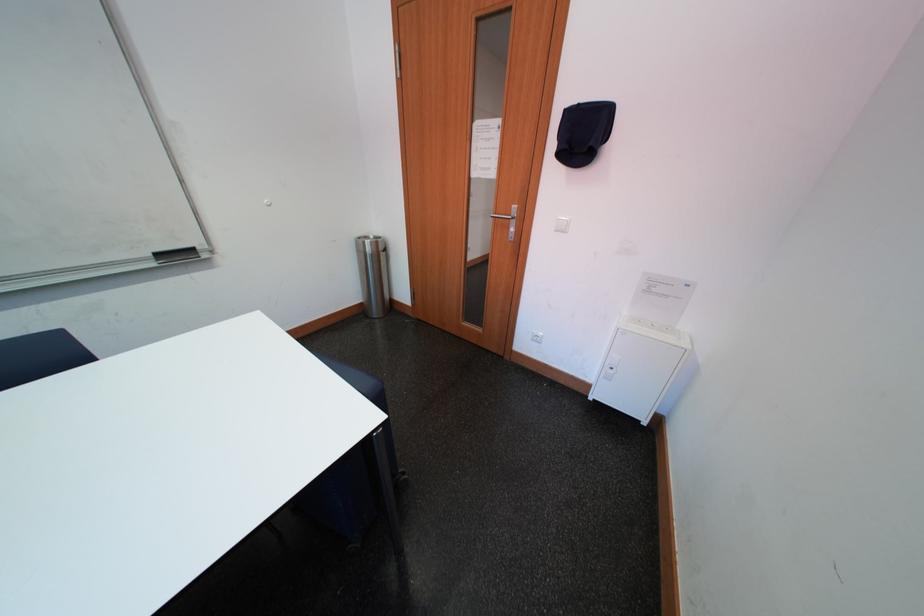
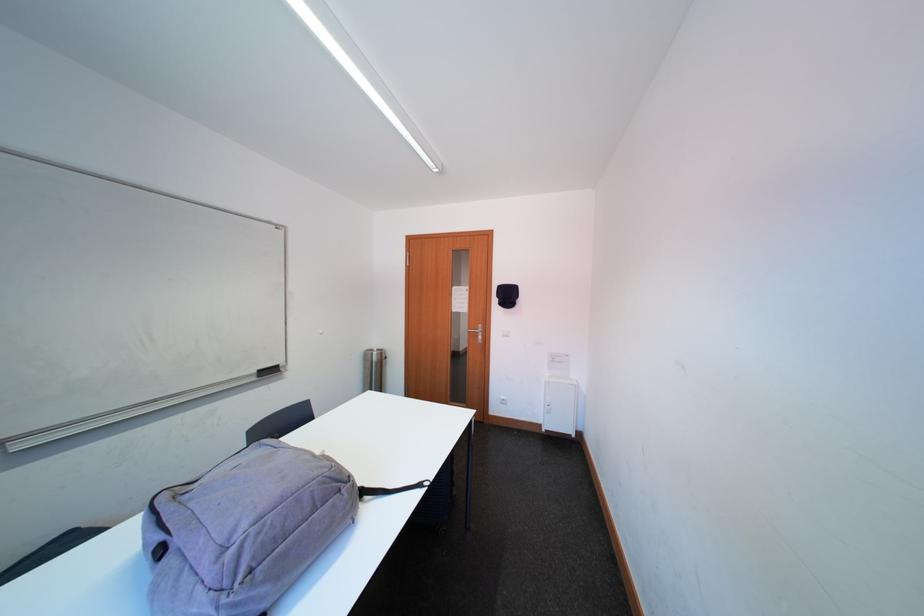
Locate, in the second image, the point that corresponds to [373,246] in the first image.

(382, 358)